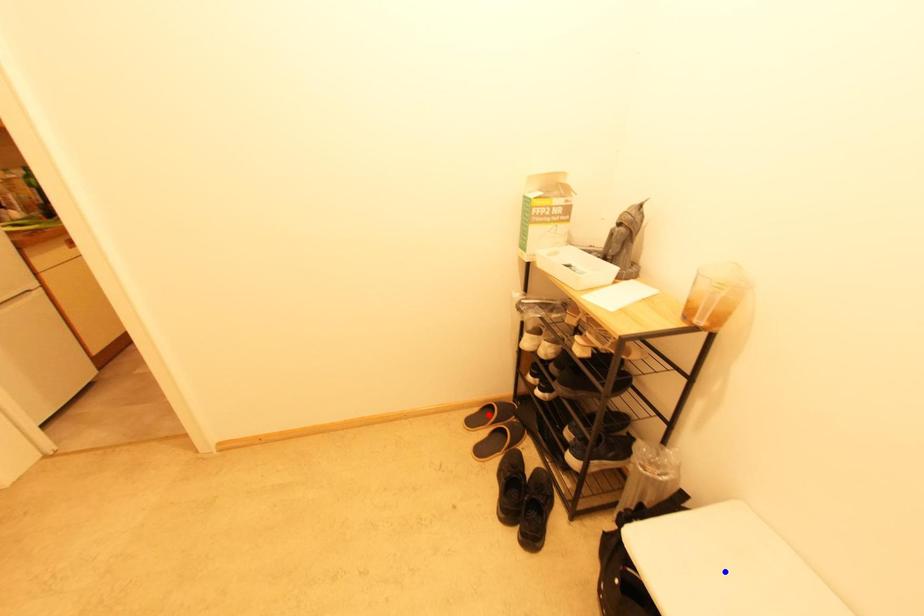
Question: Which of the two points in the image is closer to the camera?

Choices:
 (A) Blue point is closer.
 (B) Red point is closer.

Answer: (A)